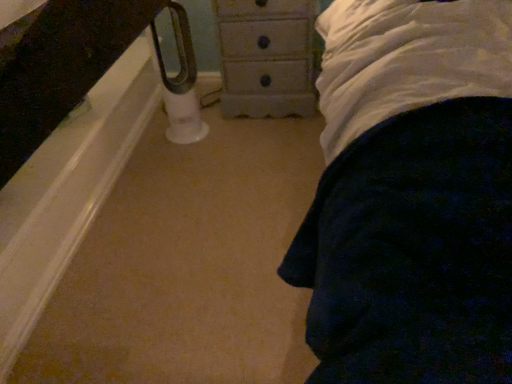
At what (x,y) coordinates should I click in order to perform the action: click on vacant area that is situated to the right of white plastic towel bar at lower left. Please return your answer as a coordinate pair (x, y). Image resolution: width=512 pixels, height=384 pixels. Looking at the image, I should click on (226, 138).